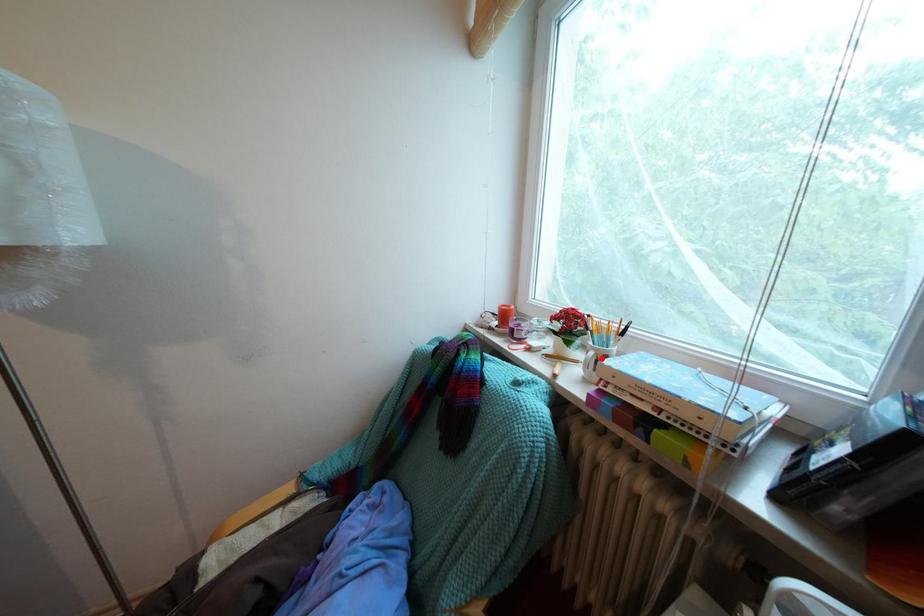
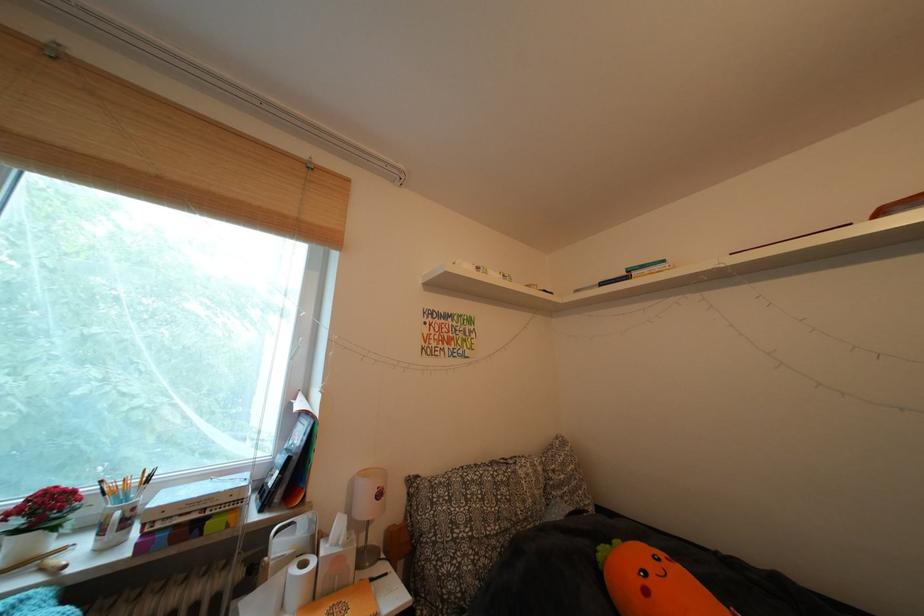
The point at the highlighted location is marked in the first image. Where is the corresponding point in the second image?

(128, 519)